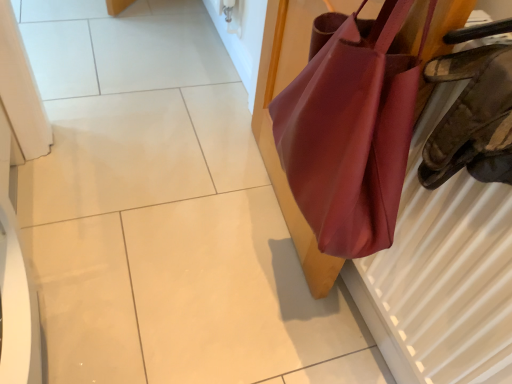
What is the approximate height of matte brown radiator at right?

matte brown radiator at right is 59.21 centimeters tall.

Describe the element at coordinates (442, 274) in the screenshot. The image size is (512, 384). I see `matte brown radiator at right` at that location.

The image size is (512, 384). I want to click on matte brown radiator at right, so click(x=442, y=274).

What are the coordinates of `matte leather handbag at right` in the screenshot? It's located at (351, 133).

The width and height of the screenshot is (512, 384). What do you see at coordinates (351, 133) in the screenshot? I see `matte leather handbag at right` at bounding box center [351, 133].

Locate an element on the screen. The image size is (512, 384). matte brown radiator at right is located at coordinates (442, 274).

Considering the positions of objects matte brown radiator at right and matte leather handbag at right in the image provided, who is more to the left, matte brown radiator at right or matte leather handbag at right?

Positioned to the left is matte leather handbag at right.

Which object is further away from the camera taking this photo, matte brown radiator at right or matte leather handbag at right?

A: matte leather handbag at right is behind.

Does point (489, 194) lie behind point (302, 108)?

That is False.

From the image's perspective, does matte brown radiator at right appear lower than matte leather handbag at right?

Indeed, from the image's perspective, matte brown radiator at right is shown beneath matte leather handbag at right.

From a real-world perspective, which object stands above the other?

matte brown radiator at right is physically above.

Consider the image. Which of these two, matte brown radiator at right or matte leather handbag at right, is thinner?

matte brown radiator at right.

Can you confirm if matte brown radiator at right is shorter than matte leather handbag at right?

Yes, matte brown radiator at right is shorter than matte leather handbag at right.

Which of these two, matte brown radiator at right or matte leather handbag at right, is smaller?

Smaller between the two is matte brown radiator at right.

Is matte brown radiator at right inside or outside of matte leather handbag at right?

matte brown radiator at right is outside matte leather handbag at right.

Is there a large distance between matte brown radiator at right and matte leather handbag at right?

No, matte brown radiator at right is in close proximity to matte leather handbag at right.

Is matte brown radiator at right oriented towards matte leather handbag at right?

Yes, matte brown radiator at right is oriented towards matte leather handbag at right.

What's the angular difference between matte brown radiator at right and matte leather handbag at right's facing directions?

matte brown radiator at right and matte leather handbag at right are facing 0.304 degrees away from each other.

At what (x,y) coordinates should I click in order to perform the action: click on handbag that appears behind the matte brown radiator at right. Please return your answer as a coordinate pair (x, y). The image size is (512, 384). Looking at the image, I should click on (351, 133).

Considering the positions of objects matte leather handbag at right and matte brown radiator at right in the image provided, who is more to the left, matte leather handbag at right or matte brown radiator at right?

From the viewer's perspective, matte leather handbag at right appears more on the left side.

Which object is closer to the camera taking this photo, matte leather handbag at right or matte brown radiator at right?

matte brown radiator at right is closer to the camera.

Is point (329, 145) positioned before point (444, 331)?

Yes, it is.

From the image's perspective, would you say matte leather handbag at right is shown under matte brown radiator at right?

Actually, matte leather handbag at right appears above matte brown radiator at right in the image.

From a real-world perspective, is matte leather handbag at right positioned over matte brown radiator at right based on gravity?

Actually, matte leather handbag at right is physically below matte brown radiator at right in the real world.

Which of these two, matte leather handbag at right or matte brown radiator at right, is wider?

matte leather handbag at right is wider.

Does matte leather handbag at right have a greater height compared to matte brown radiator at right?

Yes, matte leather handbag at right is taller than matte brown radiator at right.

Which of these two, matte leather handbag at right or matte brown radiator at right, is smaller?

matte brown radiator at right is smaller.

Is matte leather handbag at right outside of matte brown radiator at right?

Indeed, matte leather handbag at right is completely outside matte brown radiator at right.

Would you say matte leather handbag at right is a long distance from matte brown radiator at right?

That's not correct — matte leather handbag at right is a little close to matte brown radiator at right.

Is matte leather handbag at right oriented towards matte brown radiator at right?

Yes, matte leather handbag at right is facing matte brown radiator at right.

Measure the distance between matte leather handbag at right and matte brown radiator at right.

matte leather handbag at right and matte brown radiator at right are 16.73 centimeters apart from each other.

Where is `handbag behind the matte brown radiator at right`? The height and width of the screenshot is (384, 512). handbag behind the matte brown radiator at right is located at coordinates (351, 133).

The height and width of the screenshot is (384, 512). In order to click on radiator below the matte leather handbag at right (from the image's perspective) in this screenshot , I will do `click(442, 274)`.

Find the location of a particular element. radiator lying on the right of matte leather handbag at right is located at coordinates (442, 274).